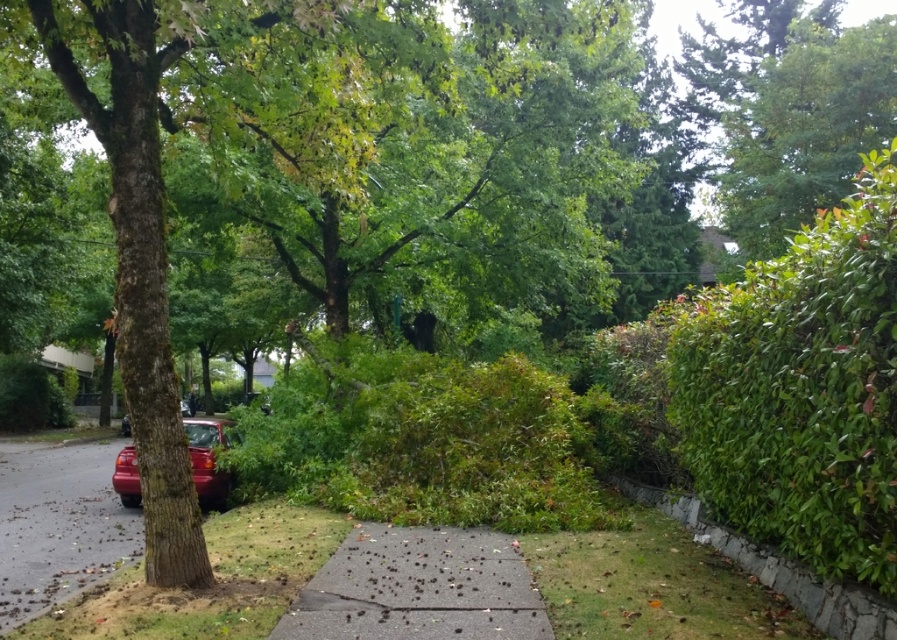
You are standing on the sidewalk in the suburban street scene. You see two points marked in the image. The first point is at coordinates point (829, 595) and the second is at point (129, 481). Which point is closer to you?

Point (829, 595) is closer to the viewer than point (129, 481).

You are a delivery person with a cart that is 2 meters wide. You need to move from the shiny red car at left to the green leafy hedge at right along the sidewalk. Is there enough space between them for your cart to pass through?

The distance between the shiny red car at left and the green leafy hedge at right is 4.81 meters. Since your cart is 2 meters wide, there is sufficient space for it to pass through.

You are a gardener planning to trim the green leafy hedge at right and the gray stone curb at lower right. Which object is nearer to you, the gardener, so you should start trimming first?

The green leafy hedge at right is closer to the viewer than the gray stone curb at lower right, so you should start trimming the green leafy hedge at right first.